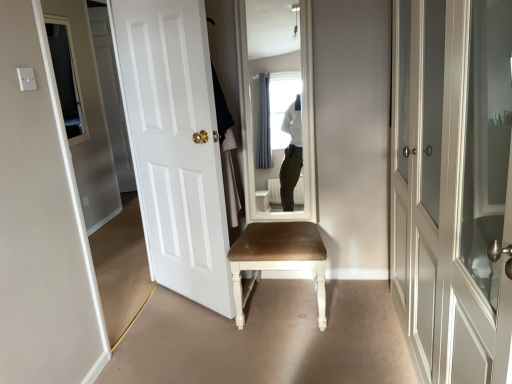
What are the coordinates of `free space below brown leather chair at center (from a real-world perspective)` in the screenshot? It's located at (281, 303).